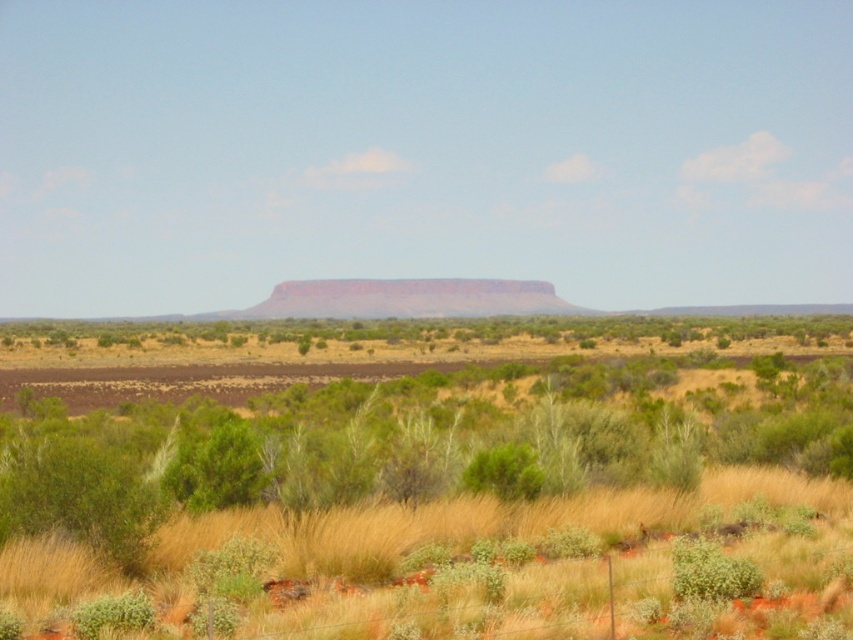
Is point (834, 467) positioned before point (735, 556)?

No, (834, 467) is further to viewer.

Can you confirm if grassy plain at center is shorter than green fuzzy bush at lower right?

No, grassy plain at center is not shorter than green fuzzy bush at lower right.

At what (x,y) coordinates should I click in order to perform the action: click on grassy plain at center. Please return your answer as a coordinate pair (x, y). The height and width of the screenshot is (640, 853). Looking at the image, I should click on (424, 484).

Between green fuzzy bush at lower right and green leafy bush at center, which one has less height?

Standing shorter between the two is green fuzzy bush at lower right.

Is point (683, 592) positioned after point (494, 461)?

No.

The width and height of the screenshot is (853, 640). Find the location of `green fuzzy bush at lower right`. green fuzzy bush at lower right is located at coordinates (711, 572).

Is the position of grassy plain at center less distant than that of green leafy bush at center?

Yes, grassy plain at center is closer to the viewer.

Between grassy plain at center and green leafy bush at center, which one has less height?

green leafy bush at center is shorter.

Does point (730, 534) come farther from viewer compared to point (527, 456)?

No, it is not.

At what (x,y) coordinates should I click in order to perform the action: click on grassy plain at center. Please return your answer as a coordinate pair (x, y). Looking at the image, I should click on (424, 484).